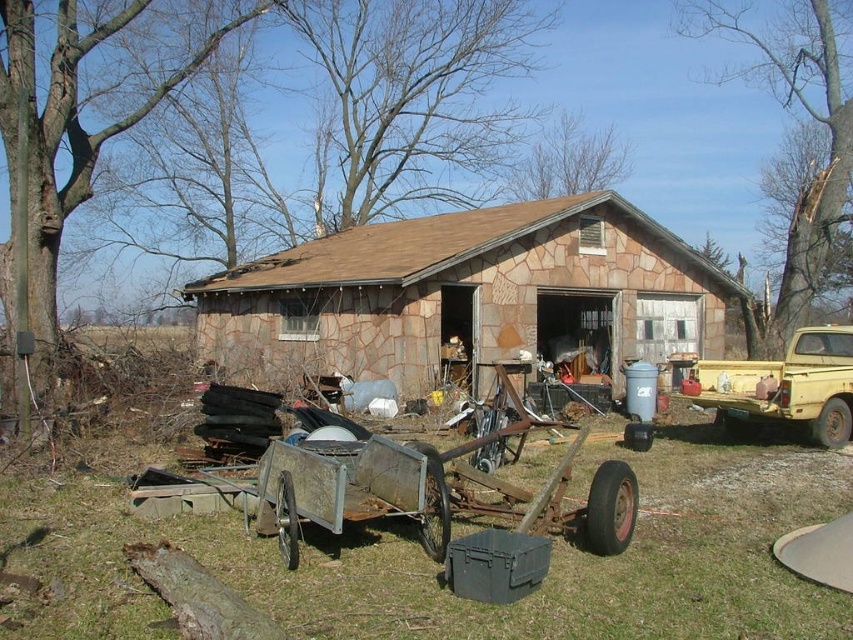
Question: Which object is positioned farthest from the brown stone hut at center?

Choices:
 (A) yellow matte truck at right
 (B) rusty metal cart at center

Answer: (B)

Question: Among these points, which one is nearest to the camera?

Choices:
 (A) (561, 230)
 (B) (793, 372)
 (C) (693, 637)

Answer: (C)

Question: Does rusty metal cart at center have a smaller size compared to brown stone hut at center?

Choices:
 (A) yes
 (B) no

Answer: (A)

Question: Among these points, which one is nearest to the camera?

Choices:
 (A) (311, 579)
 (B) (567, 228)
 (C) (819, 433)

Answer: (A)

Question: Is brown stone hut at center wider than yellow matte truck at right?

Choices:
 (A) yes
 (B) no

Answer: (A)

Question: Observing the image, what is the correct spatial positioning of brown stone hut at center in reference to yellow matte truck at right?

Choices:
 (A) left
 (B) right

Answer: (A)